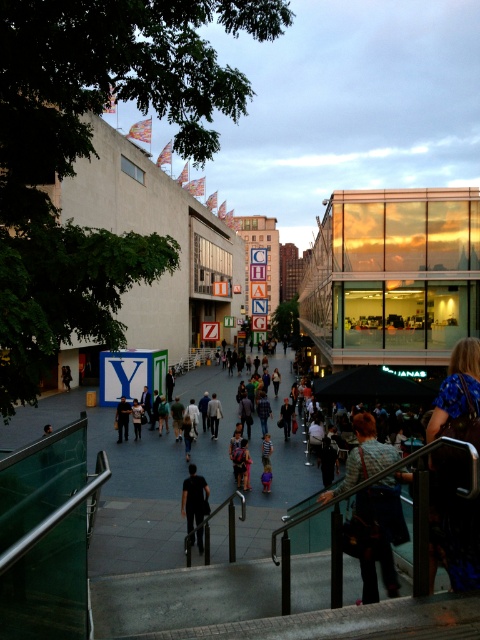
Question: Is beige concrete mall at center wider than denim jacket at center?

Choices:
 (A) no
 (B) yes

Answer: (B)

Question: In this image, where is white concrete mall at left located relative to beige concrete mall at center?

Choices:
 (A) below
 (B) above

Answer: (A)

Question: Which point is farther from the camera taking this photo?

Choices:
 (A) (122, 417)
 (B) (242, 445)
 (C) (214, 422)
 (D) (467, 518)

Answer: (C)

Question: Among these objects, which one is farthest from the camera?

Choices:
 (A) dark blue shirt at center
 (B) blue floral shirt at lower right
 (C) checkered fabric shirt at center

Answer: (A)

Question: Which object is the closest to the checkered fabric shirt at center?

Choices:
 (A) beige concrete mall at center
 (B) dark blue jeans at center
 (C) black matte shirt at center
 (D) dark blue shirt at center

Answer: (C)

Question: Can you confirm if blue floral shirt at lower right is smaller than black matte shirt at center?

Choices:
 (A) no
 (B) yes

Answer: (B)